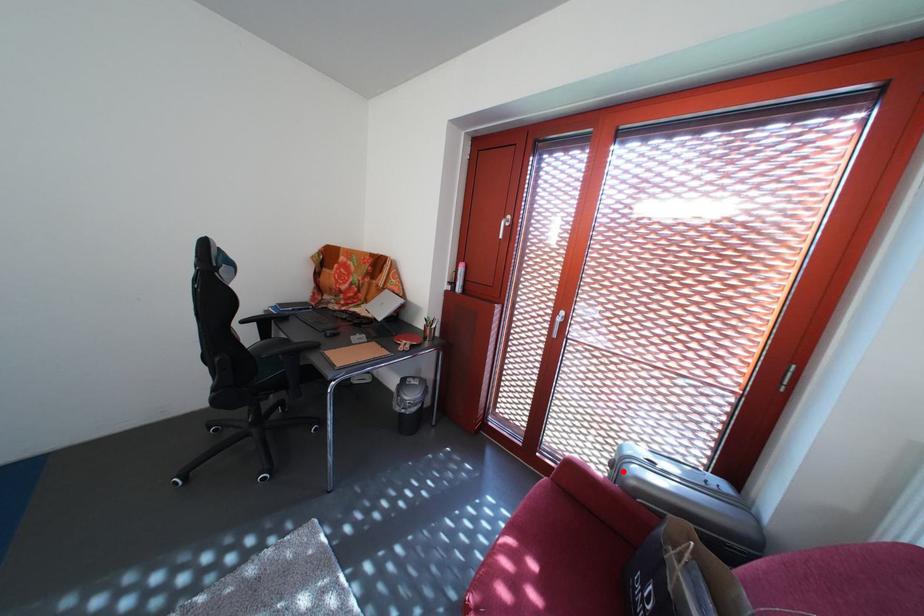
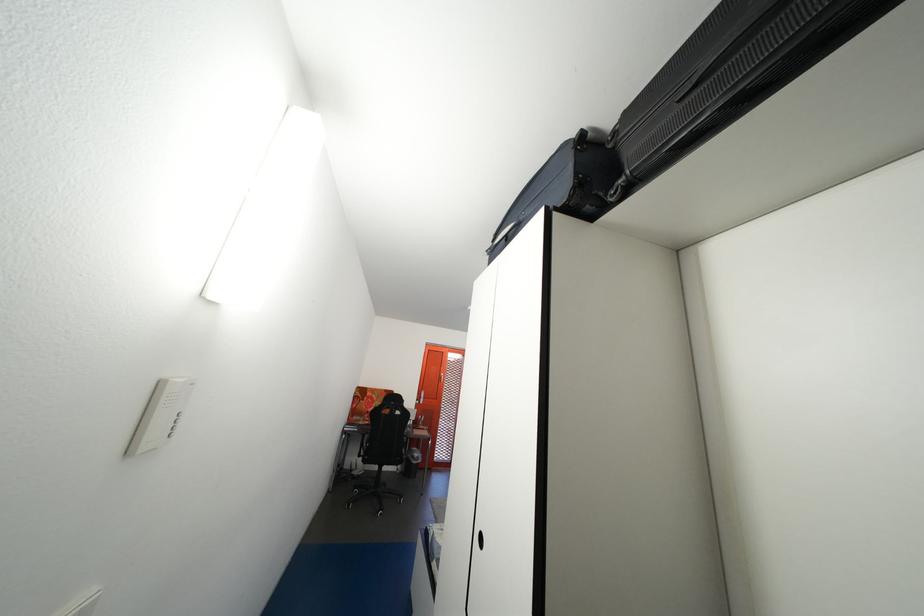
Question: I am providing you with two images of the same scene from different viewpoints. A red point is marked on the first image. Can you still see the location of the red point in image 2?

Choices:
 (A) Yes
 (B) No

Answer: (B)